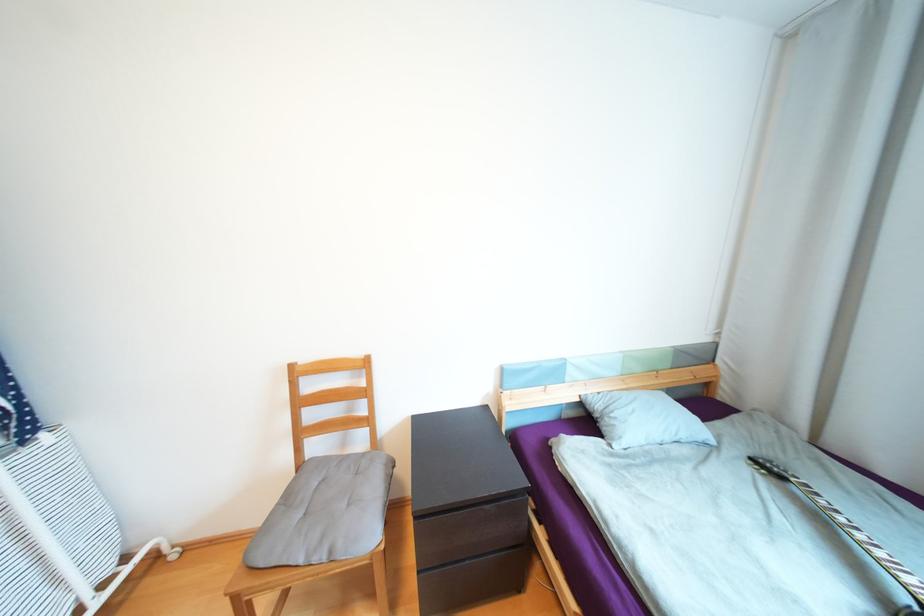
Where would you lift the patterned guitar strap? Please return your answer as a coordinate pair (x, y).

(852, 535)